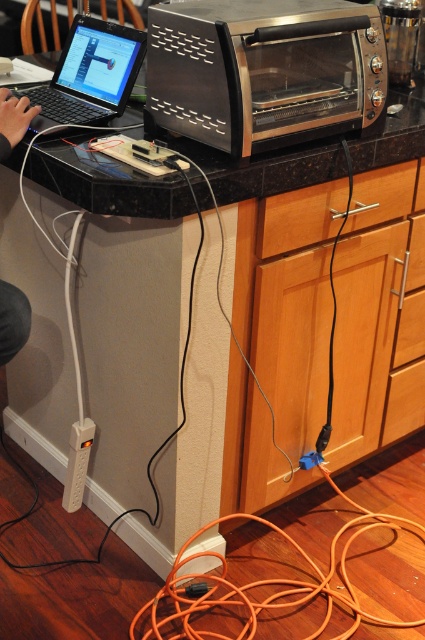
Question: Which object appears closest to the camera in this image?

Choices:
 (A) black granite countertop at upper center
 (B) satin metallic toaster oven at upper right
 (C) skinny jeans at lower left

Answer: (B)

Question: Which of these objects is positioned closest to the white plastic plug at lower left?

Choices:
 (A) satin metallic toaster oven at upper right
 (B) skinny jeans at lower left
 (C) black granite countertop at upper center
 (D) matte black laptop at left

Answer: (C)

Question: Considering the relative positions of black granite countertop at upper center and skinny jeans at lower left in the image provided, where is black granite countertop at upper center located with respect to skinny jeans at lower left?

Choices:
 (A) below
 (B) above

Answer: (B)

Question: Does black granite countertop at upper center appear over skinny jeans at lower left?

Choices:
 (A) yes
 (B) no

Answer: (A)

Question: Where is skinny jeans at lower left located in relation to white plastic plug at lower left in the image?

Choices:
 (A) left
 (B) right

Answer: (A)

Question: Which object is positioned farthest from the skinny jeans at lower left?

Choices:
 (A) white plastic plug at lower left
 (B) matte black laptop at left

Answer: (A)